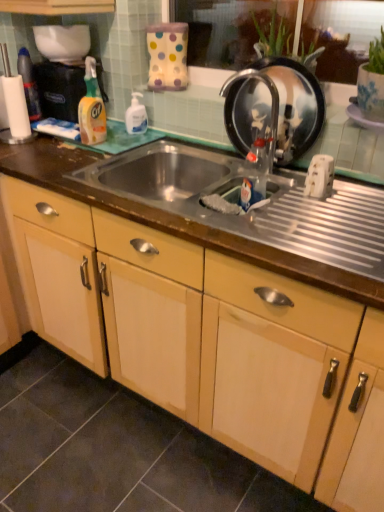
Image resolution: width=384 pixels, height=512 pixels. I want to click on empty space that is to the right of yellow plastic spray bottle at left, acting as the first cleaning product starting from the left, so (x=124, y=141).